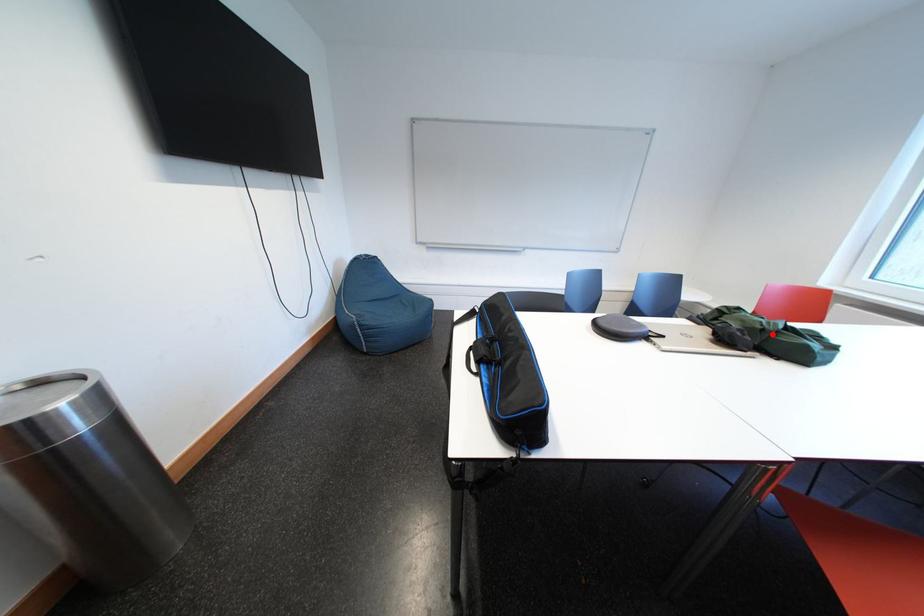
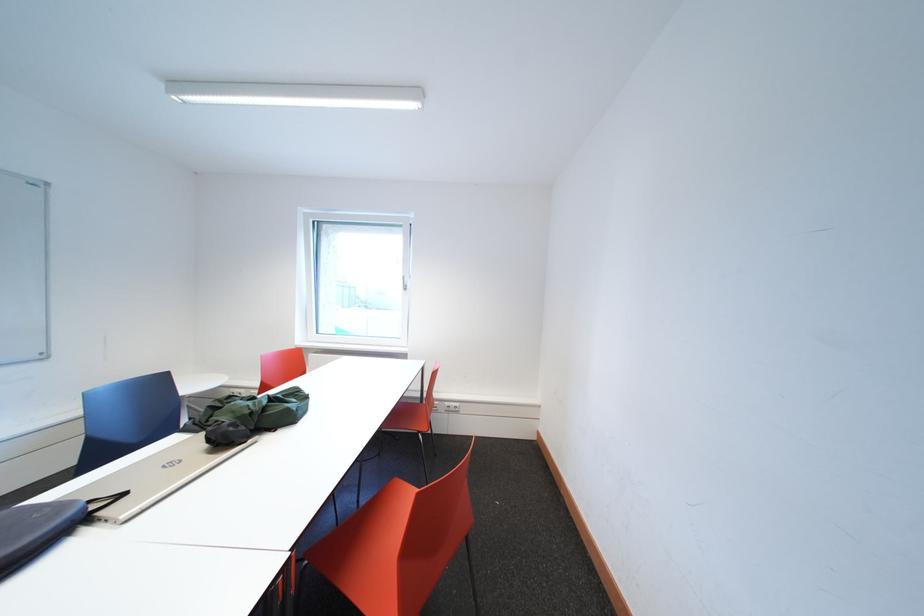
Find the pixel in the second image that matches the highlighted location in the first image.

(261, 418)